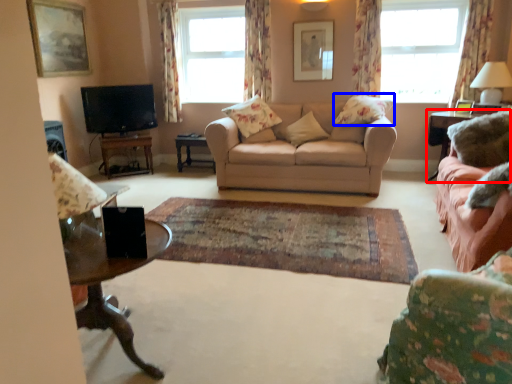
Question: Which point is closer to the camera, table (highlighted by a red box) or pillow (highlighted by a blue box)?

Choices:
 (A) table
 (B) pillow

Answer: (A)